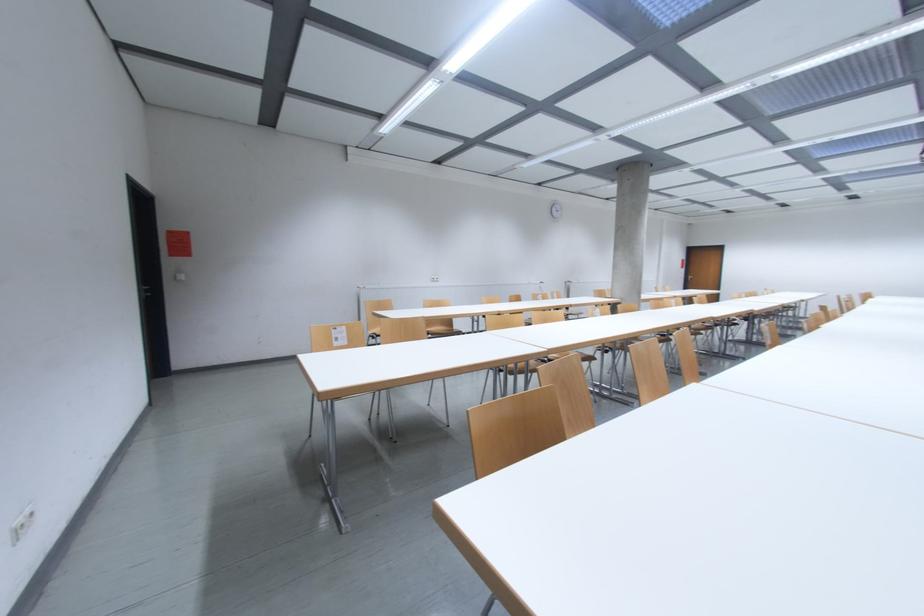
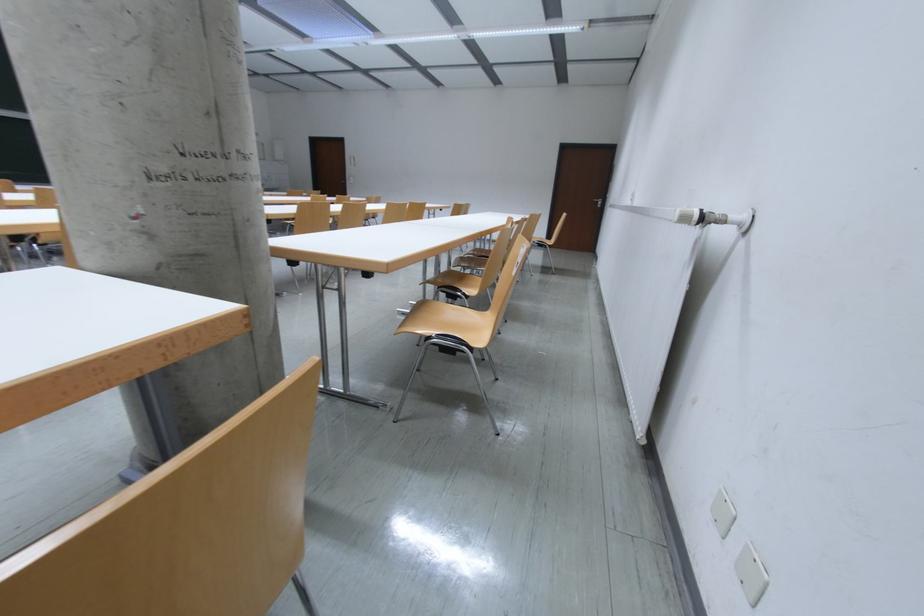
In the second image, find the point that corresponds to (x=553, y=284) in the first image.

(694, 221)